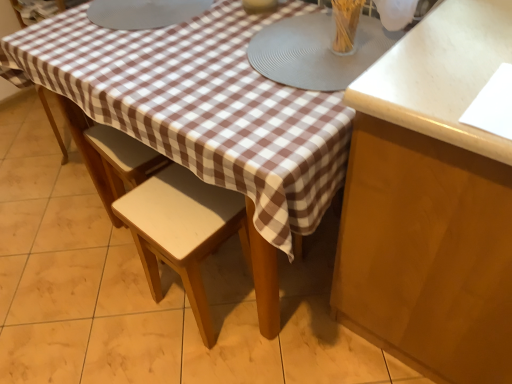
At what (x,y) coordinates should I click in order to perform the action: click on free space that is to the left of clear glass vase at upper center. Please return your answer as a coordinate pair (x, y). The height and width of the screenshot is (384, 512). Looking at the image, I should click on (283, 54).